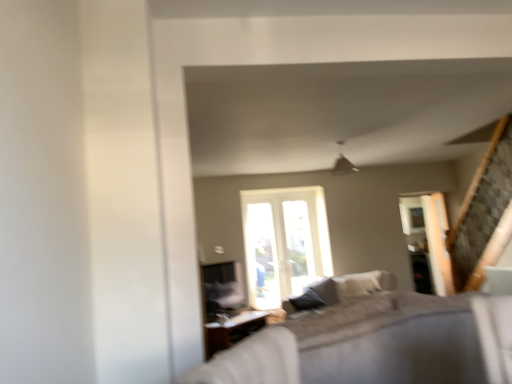
Question: In the image, is wooden table at lower center on the left side or the right side of clear glass screen door at right?

Choices:
 (A) right
 (B) left

Answer: (B)

Question: Does point (233, 336) appear closer or farther from the camera than point (452, 292)?

Choices:
 (A) closer
 (B) farther

Answer: (A)

Question: Considering the real-world distances, which object is closest to the textured beige couch at center?

Choices:
 (A) wooden table at lower center
 (B) clear glass screen door at right

Answer: (B)

Question: Estimate the real-world distances between objects in this image. Which object is farther from the clear glass screen door at right?

Choices:
 (A) textured beige couch at center
 (B) wooden table at lower center

Answer: (B)